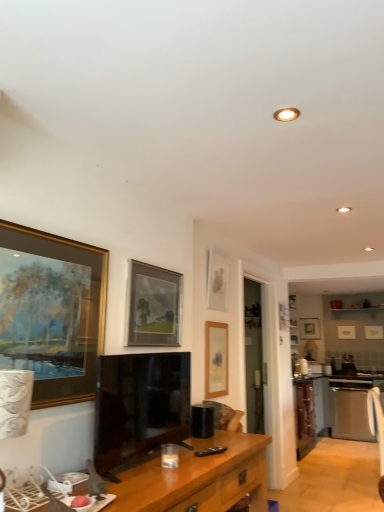
Question: From a real-world perspective, relative to matte gold picture frame at center, marked as the 7th picture frame in a front-to-back arrangement, is stainless steel oven at right vertically above or below?

Choices:
 (A) below
 (B) above

Answer: (A)

Question: Considering the positions of stainless steel oven at right and matte gold picture frame at center, which is the 1th picture frame from back to front, in the image, is stainless steel oven at right taller or shorter than matte gold picture frame at center, which is the 1th picture frame from back to front,?

Choices:
 (A) tall
 (B) short

Answer: (A)

Question: Which of these objects is positioned closest to the gold-framed painting at left, the first picture frame when ordered from front to back?

Choices:
 (A) matte gold picture frame at upper right, which appears as the seventh picture frame when viewed from the left
 (B) matte wooden picture frame at upper center, which ranks as the 4th picture frame in right-to-left order
 (C) matte gold picture frame at center, which appears as the third picture frame when viewed from the right
 (D) matte gold picture frame at upper right, which appears as the sixth picture frame when viewed from the left
 (E) stainless steel oven at right

Answer: (B)

Question: Estimate the real-world distances between objects in this image. Which object is farther from the gold-framed painting at left, which appears as the seventh picture frame when viewed from the back?

Choices:
 (A) matte gold picture frame at upper right, acting as the 3th picture frame starting from the back
 (B) wooden desk at lower center
 (C) matte black tv at center
 (D) stainless steel oven at right
 (E) matte gold picture frame at upper right, acting as the sixth picture frame starting from the front

Answer: (E)